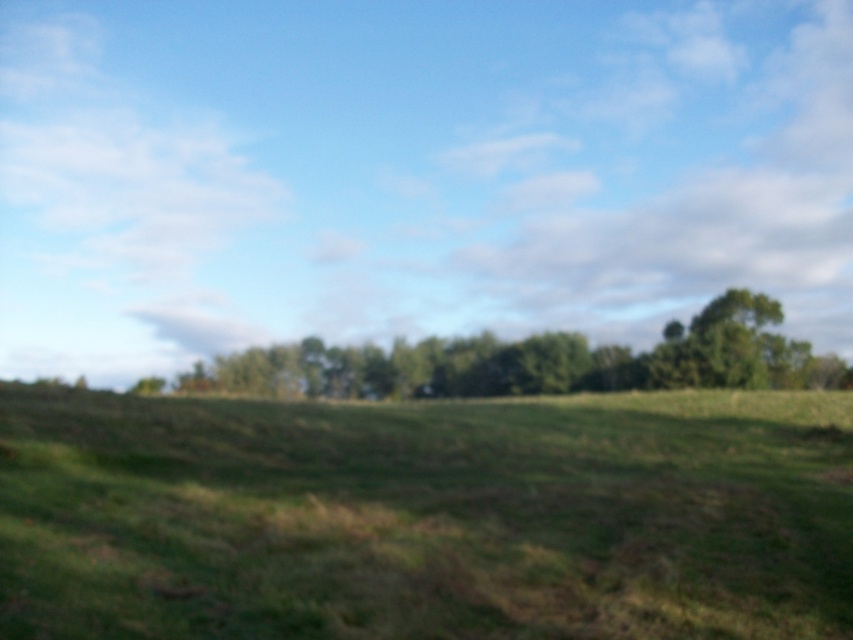
Is point (476, 554) behind point (308, 369)?

No, (476, 554) is in front of (308, 369).

The width and height of the screenshot is (853, 640). Describe the element at coordinates (426, 516) in the screenshot. I see `green grassy field at center` at that location.

At what (x,y) coordinates should I click in order to perform the action: click on green grassy field at center. Please return your answer as a coordinate pair (x, y). The height and width of the screenshot is (640, 853). Looking at the image, I should click on (426, 516).